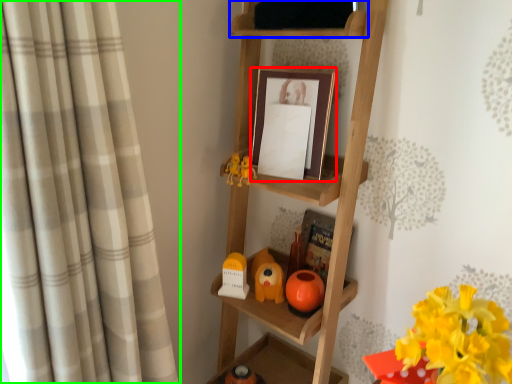
Question: Estimate the real-world distances between objects in this image. Which object is farther from picture frame (highlighted by a red box), shelf (highlighted by a blue box) or curtain (highlighted by a green box)?

Choices:
 (A) shelf
 (B) curtain

Answer: (B)